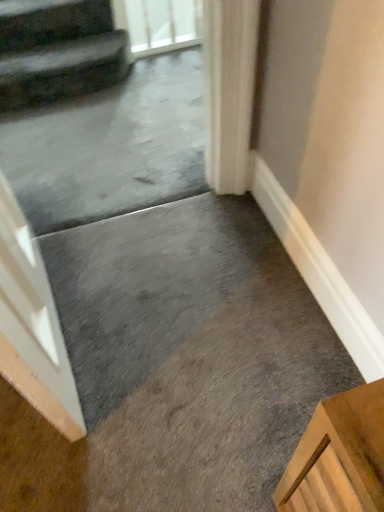
The width and height of the screenshot is (384, 512). Describe the element at coordinates (57, 51) in the screenshot. I see `dark gray plush stairs at upper left` at that location.

At what (x,y) coordinates should I click in order to perform the action: click on dark gray plush stairs at upper left. Please return your answer as a coordinate pair (x, y). This screenshot has width=384, height=512. Looking at the image, I should click on (57, 51).

Describe the element at coordinates (159, 24) in the screenshot. This screenshot has width=384, height=512. I see `clear glass screen door at upper center` at that location.

Where is `clear glass screen door at upper center`? clear glass screen door at upper center is located at coordinates (159, 24).

This screenshot has width=384, height=512. Find the location of `dark gray plush stairs at upper left`. dark gray plush stairs at upper left is located at coordinates (57, 51).

Can you confirm if clear glass screen door at upper center is positioned to the right of dark gray plush stairs at upper left?

Indeed, clear glass screen door at upper center is positioned on the right side of dark gray plush stairs at upper left.

Which object is further away from the camera, clear glass screen door at upper center or dark gray plush stairs at upper left?

clear glass screen door at upper center is further away from the camera.

Is point (184, 42) closer or farther from the camera than point (4, 71)?

Point (184, 42) appears to be farther away from the viewer than point (4, 71).

From the image's perspective, is clear glass screen door at upper center beneath dark gray plush stairs at upper left?

No, from the image's perspective, clear glass screen door at upper center is not below dark gray plush stairs at upper left.

From a real-world perspective, is clear glass screen door at upper center physically located above or below dark gray plush stairs at upper left?

clear glass screen door at upper center is above dark gray plush stairs at upper left.

Considering the relative sizes of clear glass screen door at upper center and dark gray plush stairs at upper left in the image provided, is clear glass screen door at upper center thinner than dark gray plush stairs at upper left?

Yes.

Consider the image. Between clear glass screen door at upper center and dark gray plush stairs at upper left, which one has less height?

With less height is dark gray plush stairs at upper left.

Can you confirm if clear glass screen door at upper center is smaller than dark gray plush stairs at upper left?

Indeed, clear glass screen door at upper center has a smaller size compared to dark gray plush stairs at upper left.

Is clear glass screen door at upper center not inside dark gray plush stairs at upper left?

Indeed, clear glass screen door at upper center is completely outside dark gray plush stairs at upper left.

Are clear glass screen door at upper center and dark gray plush stairs at upper left beside each other?

clear glass screen door at upper center is not next to dark gray plush stairs at upper left, and they're not touching.

Looking at this image, does clear glass screen door at upper center turn towards dark gray plush stairs at upper left?

No, clear glass screen door at upper center is not aimed at dark gray plush stairs at upper left.

What's the angular difference between clear glass screen door at upper center and dark gray plush stairs at upper left's facing directions?

0.74 degrees separate the facing orientations of clear glass screen door at upper center and dark gray plush stairs at upper left.

Measure the distance from clear glass screen door at upper center to dark gray plush stairs at upper left.

They are 13.74 inches apart.

In the image, there is a clear glass screen door at upper center. Identify the location of stairs below it (from the image's perspective). (57, 51).

In the scene shown: Which is more to the right, dark gray plush stairs at upper left or clear glass screen door at upper center?

From the viewer's perspective, clear glass screen door at upper center appears more on the right side.

Based on the photo, who is more distant, dark gray plush stairs at upper left or clear glass screen door at upper center?

clear glass screen door at upper center is behind.

Is point (39, 30) in front of point (129, 23)?

Yes, it is in front of point (129, 23).

In the scene shown: From the image's perspective, relative to clear glass screen door at upper center, is dark gray plush stairs at upper left above or below?

dark gray plush stairs at upper left is below clear glass screen door at upper center.

From a real-world perspective, is dark gray plush stairs at upper left above or below clear glass screen door at upper center?

Clearly, from a real-world perspective, dark gray plush stairs at upper left is below clear glass screen door at upper center.

Based on the photo, is dark gray plush stairs at upper left wider or thinner than clear glass screen door at upper center?

In the image, dark gray plush stairs at upper left appears to be wider than clear glass screen door at upper center.

Considering the sizes of dark gray plush stairs at upper left and clear glass screen door at upper center in the image, is dark gray plush stairs at upper left taller or shorter than clear glass screen door at upper center?

Clearly, dark gray plush stairs at upper left is shorter compared to clear glass screen door at upper center.

Considering the sizes of objects dark gray plush stairs at upper left and clear glass screen door at upper center in the image provided, who is bigger, dark gray plush stairs at upper left or clear glass screen door at upper center?

Result: With larger size is dark gray plush stairs at upper left.

Can clear glass screen door at upper center be found inside dark gray plush stairs at upper left?

That's incorrect, clear glass screen door at upper center is not inside dark gray plush stairs at upper left.

Would you say dark gray plush stairs at upper left is a long distance from clear glass screen door at upper center?

No, dark gray plush stairs at upper left is not far away from clear glass screen door at upper center.

Is clear glass screen door at upper center at the back of dark gray plush stairs at upper left?

No, dark gray plush stairs at upper left is not facing away from clear glass screen door at upper center.

Measure the distance between dark gray plush stairs at upper left and clear glass screen door at upper center.

A distance of 13.74 inches exists between dark gray plush stairs at upper left and clear glass screen door at upper center.

At what (x,y) coordinates should I click in order to perform the action: click on screen door on the right side of dark gray plush stairs at upper left. Please return your answer as a coordinate pair (x, y). The height and width of the screenshot is (512, 384). Looking at the image, I should click on (159, 24).

The image size is (384, 512). Find the location of `screen door that appears above the dark gray plush stairs at upper left (from a real-world perspective)`. screen door that appears above the dark gray plush stairs at upper left (from a real-world perspective) is located at coordinates (159, 24).

Locate an element on the screen. The width and height of the screenshot is (384, 512). stairs below the clear glass screen door at upper center (from the image's perspective) is located at coordinates (57, 51).